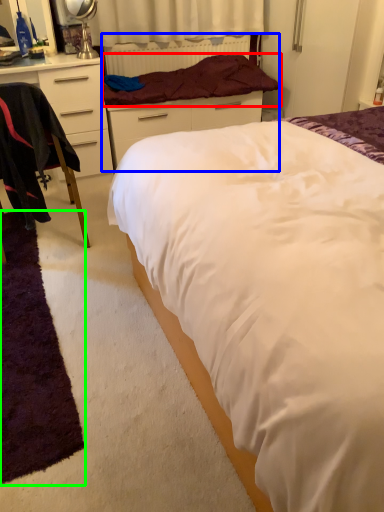
Question: Considering the real-world distances, which object is farthest from blanket (highlighted by a red box)? bed frame (highlighted by a blue box) or mat (highlighted by a green box)?

Choices:
 (A) bed frame
 (B) mat

Answer: (B)